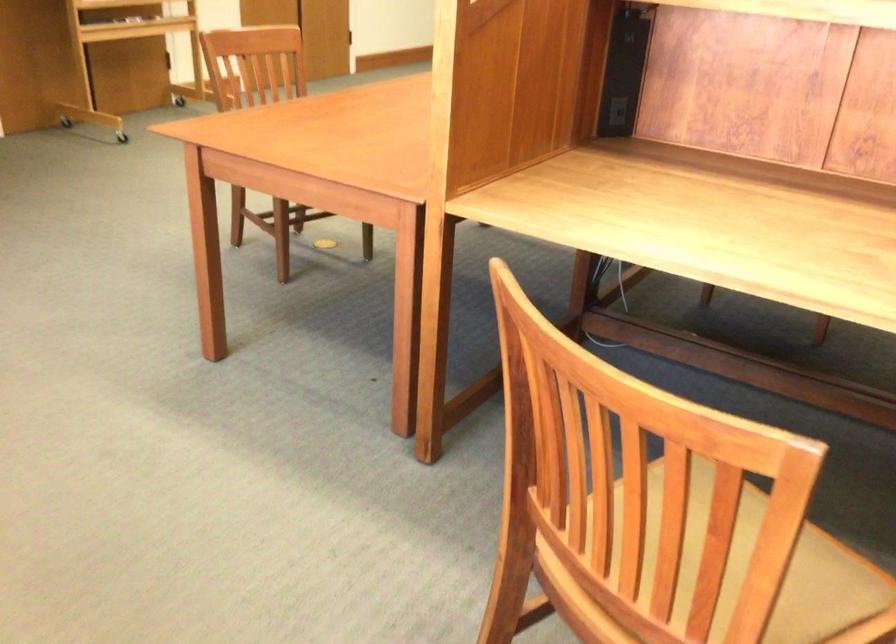
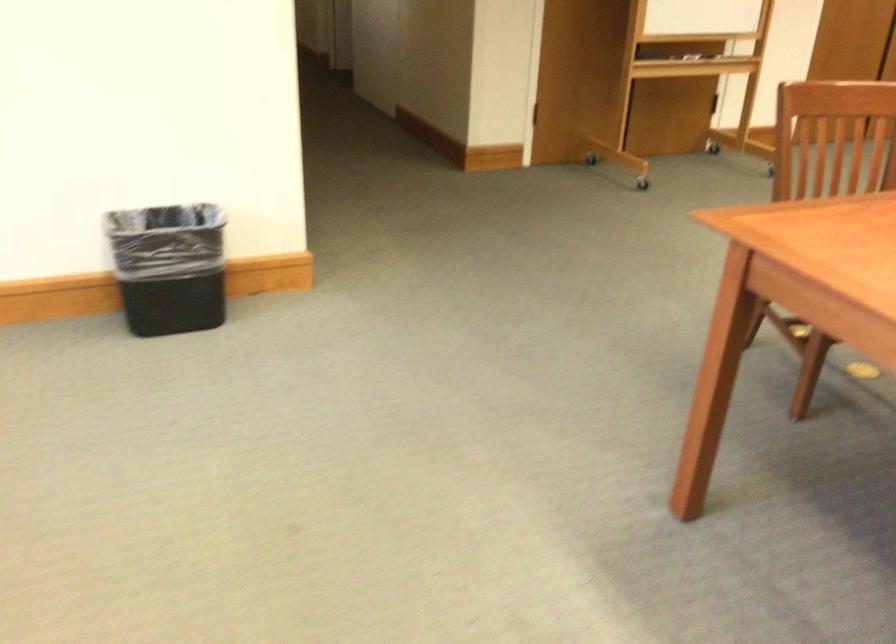
Locate, in the second image, the point that corresponds to pixel 266 122 in the first image.

(849, 220)